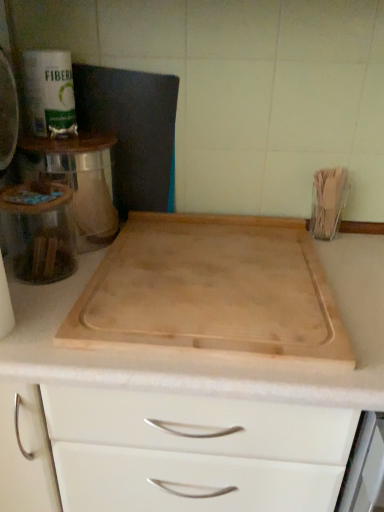
Locate an element on the screen. unoccupied area in front of clear glass jar at left, the second appliance positioned from the left is located at coordinates (48, 330).